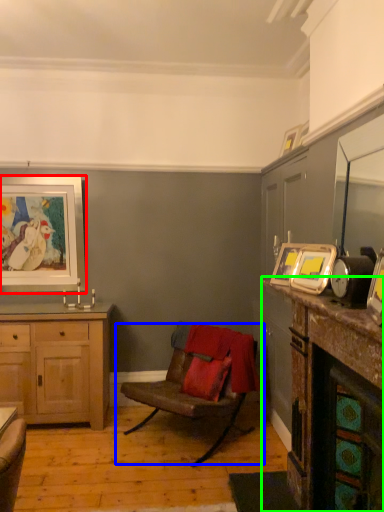
Question: Based on their relative distances, which object is nearer to picture frame (highlighted by a red box)? Choose from chair (highlighted by a blue box) and counter top (highlighted by a green box).

Choices:
 (A) chair
 (B) counter top

Answer: (A)